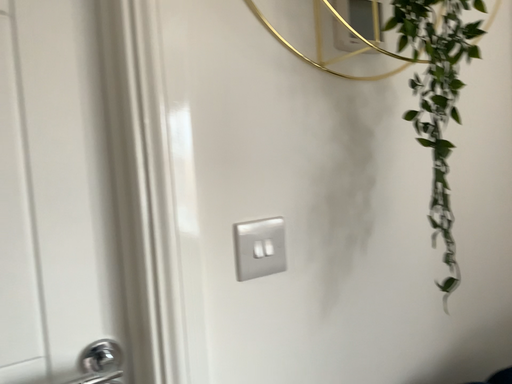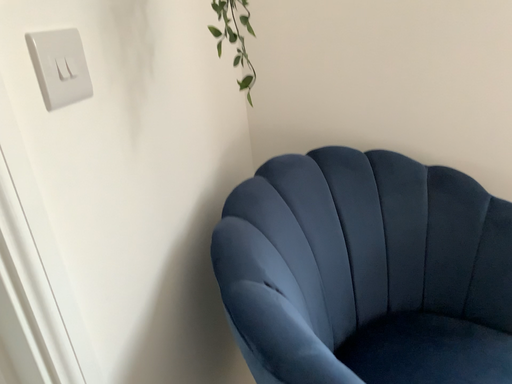
Question: How did the camera likely rotate when shooting the video?

Choices:
 (A) rotated upward
 (B) rotated downward

Answer: (B)